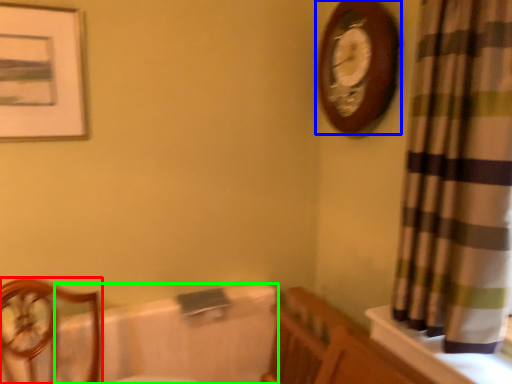
Question: Which object is the farthest from furniture (highlighted by a red box)? Choose among these: wall clock (highlighted by a blue box) or bath (highlighted by a green box).

Choices:
 (A) wall clock
 (B) bath

Answer: (A)